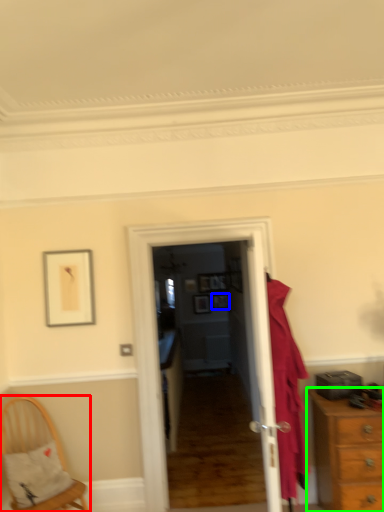
Question: Which is nearer to the chair (highlighted by a red box)? picture frame (highlighted by a blue box) or chest of drawers (highlighted by a green box).

Choices:
 (A) picture frame
 (B) chest of drawers

Answer: (B)